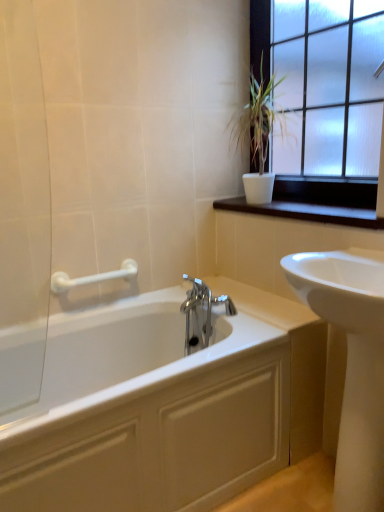
Question: From a real-world perspective, is white plastic grab bar at upper left located higher than frosted glass window at upper right?

Choices:
 (A) no
 (B) yes

Answer: (A)

Question: Can you confirm if white plastic grab bar at upper left is thinner than frosted glass window at upper right?

Choices:
 (A) yes
 (B) no

Answer: (A)

Question: Could you tell me if white plastic grab bar at upper left is facing frosted glass window at upper right?

Choices:
 (A) yes
 (B) no

Answer: (B)

Question: Is white plastic grab bar at upper left located outside frosted glass window at upper right?

Choices:
 (A) yes
 (B) no

Answer: (A)

Question: Is white plastic grab bar at upper left bigger than frosted glass window at upper right?

Choices:
 (A) yes
 (B) no

Answer: (B)

Question: Considering the positions of frosted glass window at upper right and white plastic grab bar at upper left in the image, is frosted glass window at upper right wider or thinner than white plastic grab bar at upper left?

Choices:
 (A) thin
 (B) wide

Answer: (B)

Question: Considering the positions of frosted glass window at upper right and white plastic grab bar at upper left in the image, is frosted glass window at upper right taller or shorter than white plastic grab bar at upper left?

Choices:
 (A) tall
 (B) short

Answer: (A)

Question: Is point (307, 170) closer or farther from the camera than point (130, 262)?

Choices:
 (A) closer
 (B) farther

Answer: (B)

Question: Is frosted glass window at upper right to the left or to the right of white plastic grab bar at upper left in the image?

Choices:
 (A) left
 (B) right

Answer: (B)

Question: Would you say white ceramic plant at upper right is inside or outside white plastic grab bar at upper left?

Choices:
 (A) outside
 (B) inside

Answer: (A)

Question: In terms of height, does white ceramic plant at upper right look taller or shorter compared to white plastic grab bar at upper left?

Choices:
 (A) short
 (B) tall

Answer: (B)

Question: From a real-world perspective, is white ceramic plant at upper right positioned above or below white plastic grab bar at upper left?

Choices:
 (A) above
 (B) below

Answer: (A)

Question: Is point (231, 142) positioned closer to the camera than point (51, 287)?

Choices:
 (A) farther
 (B) closer

Answer: (A)

Question: In the image, is white ceramic plant at upper right on the left side or the right side of white glossy sink at right?

Choices:
 (A) left
 (B) right

Answer: (A)

Question: Choose the correct answer: Is white ceramic plant at upper right inside white glossy sink at right or outside it?

Choices:
 (A) inside
 (B) outside

Answer: (B)